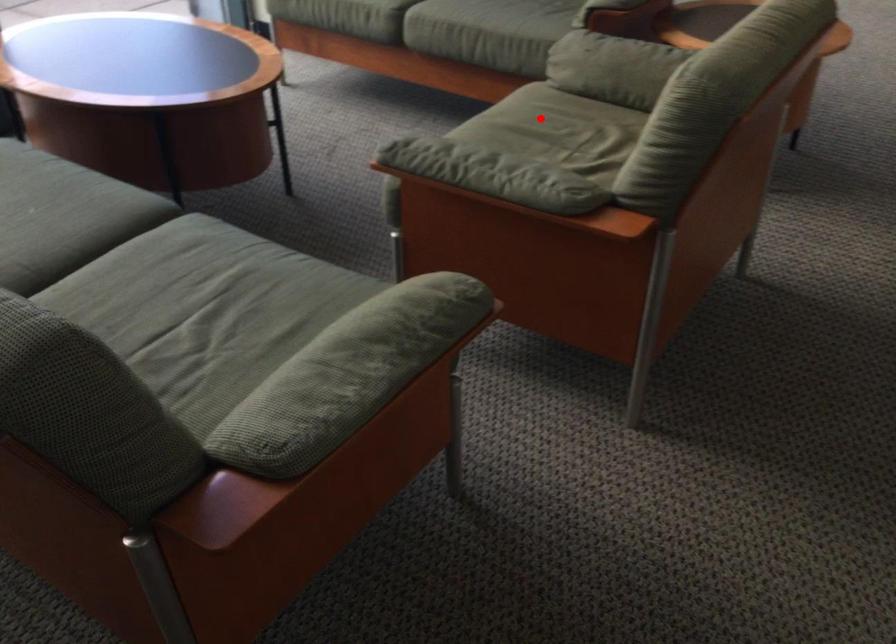
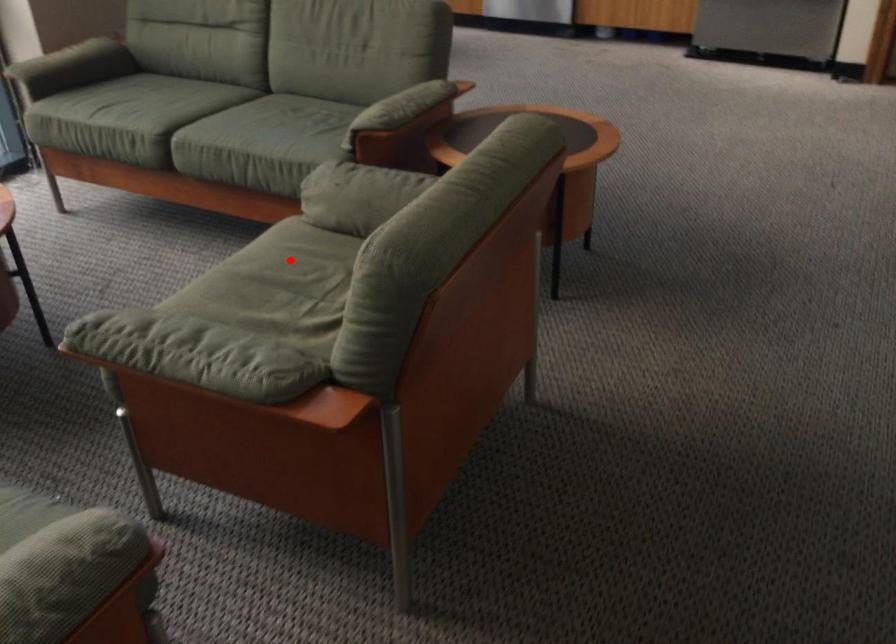
I am providing you with two images of the same scene from different viewpoints. A red point is marked on the first image and another point is marked on the second image. Is the marked point in image1 the same physical position as the marked point in image2?

Yes